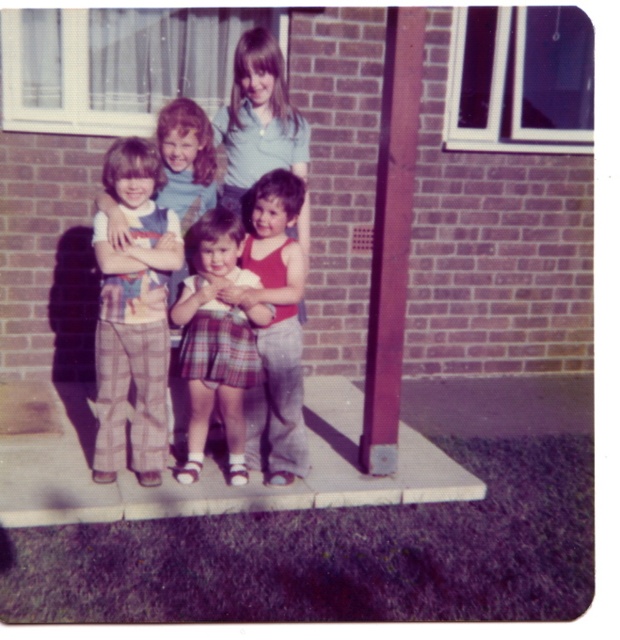
In the scene shown: You are a costume designer preparing for a historical play. You have two plaid garments from the 1950s in your collection. One is the plaid pants at left and the other is the plaid skirt at center. Which garment has a larger size?

The plaid pants at left has a larger size compared to the plaid skirt at center according to the description.

You are a photographer trying to capture a group shot of the children. The camera you are using has a lens that can focus on objects within a 30 inch range. If you want to ensure both the smooth purple pole at center and the plaid skirt at center are in focus, will your camera be able to do so?

The smooth purple pole at center and plaid skirt at center are 33.19 inches apart from each other. Since the camera lens can only focus within a 30 inch range, the distance between them exceeds this limit, so both objects cannot be in focus simultaneously.